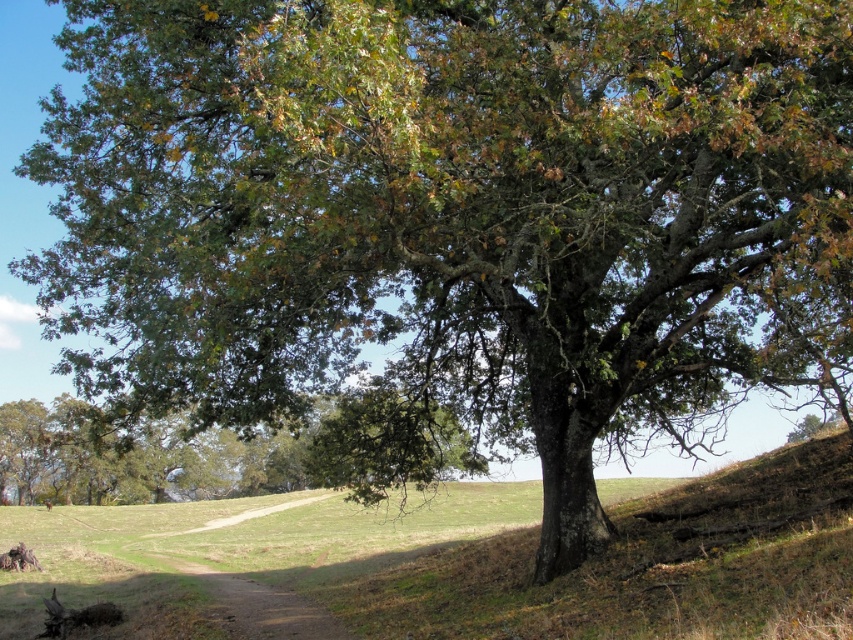
Is green leafy tree at lower left below brown fur dog at lower left?

No.

Does green leafy tree at lower left lie behind brown fur dog at lower left?

No, green leafy tree at lower left is in front of brown fur dog at lower left.

The width and height of the screenshot is (853, 640). What do you see at coordinates (165, 456) in the screenshot?
I see `green leafy tree at lower left` at bounding box center [165, 456].

Locate an element on the screen. The height and width of the screenshot is (640, 853). green leafy tree at lower left is located at coordinates (165, 456).